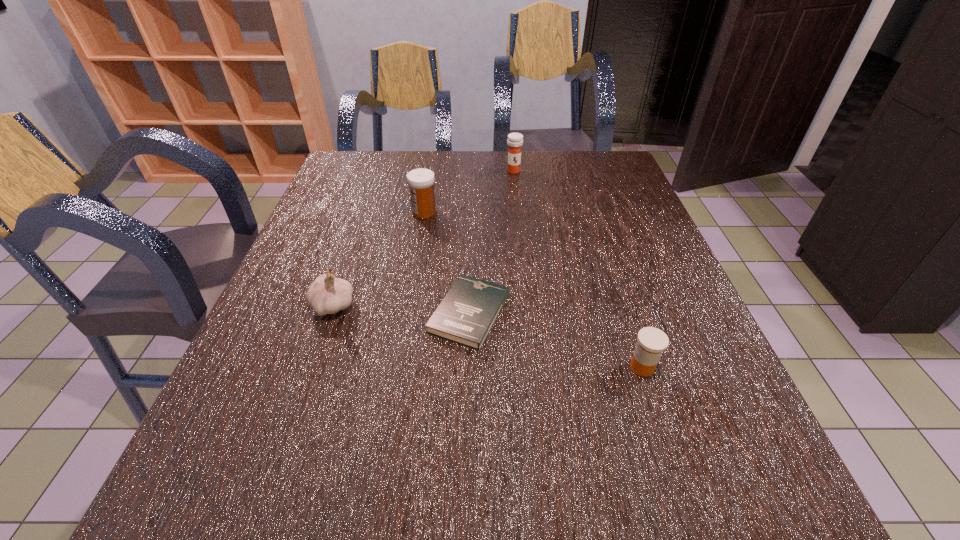
Identify the location of vacant area that lies between the shortest medicine and the third object from left to right. [556, 340].

At what (x,y) coordinates should I click in order to perform the action: click on vacant area that lies between the fourth object from left to right and the second object from left to right. Please return your answer as a coordinate pair (x, y). This screenshot has height=540, width=960. Looking at the image, I should click on (468, 192).

You are a GUI agent. You are given a task and a screenshot of the screen. Output one action in this format:
    pyautogui.click(x=<x>, y=<y>)
    Task: Click on the empty location between the rightmost medicine and the farthest object
    This screenshot has height=540, width=960.
    Given the screenshot: What is the action you would take?
    pyautogui.click(x=578, y=269)

The image size is (960, 540). In order to click on vacant region between the farthest object and the garlic in this screenshot , I will do `click(423, 238)`.

This screenshot has height=540, width=960. Identify the location of free space between the garlic and the farthest medicine. point(423,238).

Where is `free space between the leftmost medicine and the second object from right to left`? Image resolution: width=960 pixels, height=540 pixels. free space between the leftmost medicine and the second object from right to left is located at coordinates (468, 192).

Locate an element on the screen. The width and height of the screenshot is (960, 540). object that is the third closest to the book is located at coordinates (421, 181).

At what (x,y) coordinates should I click in order to perform the action: click on object that is the third closest to the nearest object. Please return your answer as a coordinate pair (x, y). Looking at the image, I should click on 421,181.

Point out which medicine is positioned as the second nearest to the second shortest object. Please provide its 2D coordinates. Your answer should be formatted as a tuple, i.e. [(x, y)], where the tuple contains the x and y coordinates of a point satisfying the conditions above.

[(515, 140)]

Identify which medicine is the second closest to the garlic. Please provide its 2D coordinates. Your answer should be formatted as a tuple, i.e. [(x, y)], where the tuple contains the x and y coordinates of a point satisfying the conditions above.

[(652, 341)]